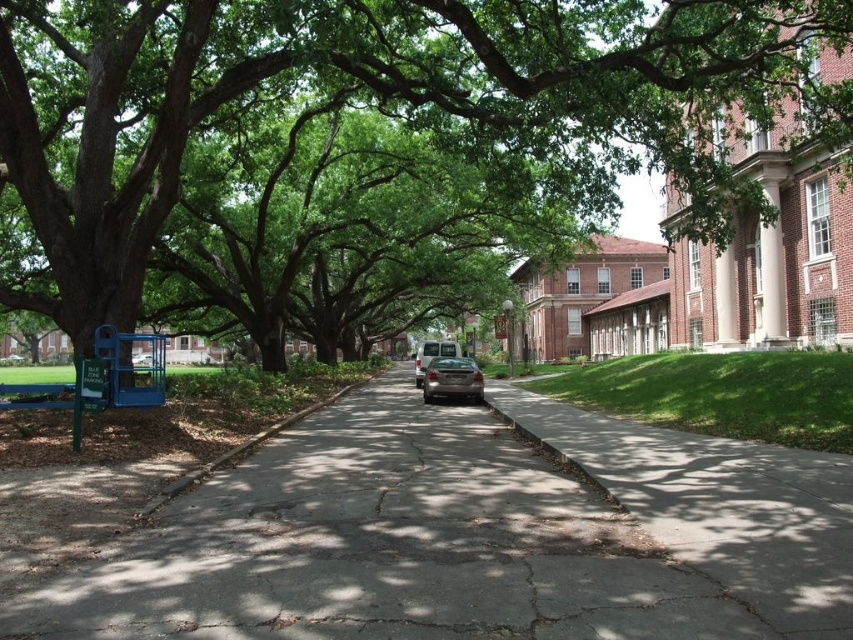
You are a pedestrian standing at the edge of the road and want to cross to the red brick buildings on the right. There is a satin black sedan at center and a metallic silver van at center in your way. Which vehicle should you move around first?

You should move around the satin black sedan at center first because it is closer to you than the metallic silver van at center, so it is the nearer obstacle to navigate around before proceeding further.

You are standing at the starting point of the street and want to walk towards the red brick buildings on the right. Which point, point (693, 541) or point (444, 342), would you reach first?

You would reach point (693, 541) first because it is in front of point (444, 342) along the street.